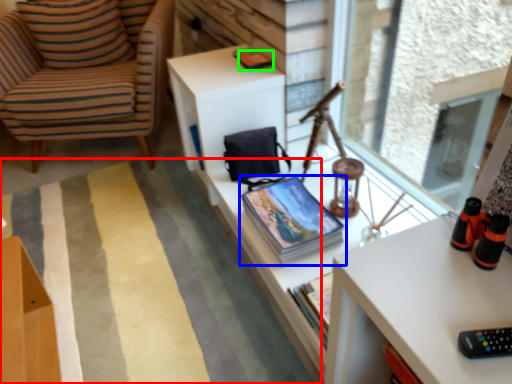
Question: Based on their relative distances, which object is farther from plain (highlighted by a red box)? Choose from book (highlighted by a blue box) and magazine (highlighted by a green box).

Choices:
 (A) book
 (B) magazine

Answer: (B)